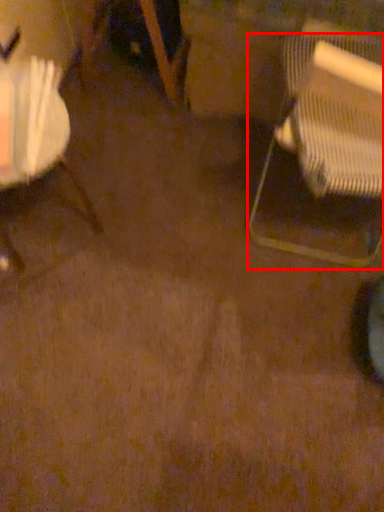
Question: Where is chair (annotated by the red box) located in relation to chair in the image?

Choices:
 (A) left
 (B) right

Answer: (B)